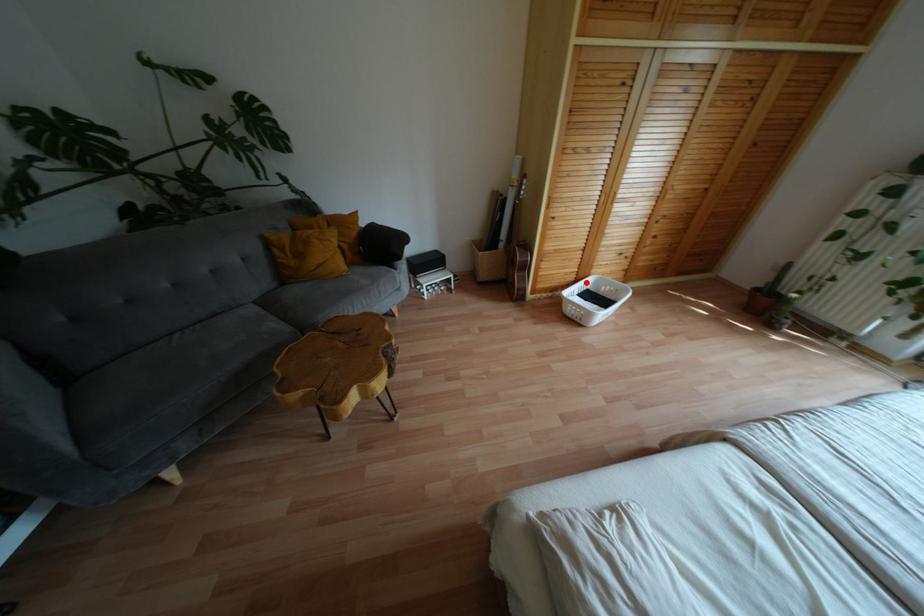
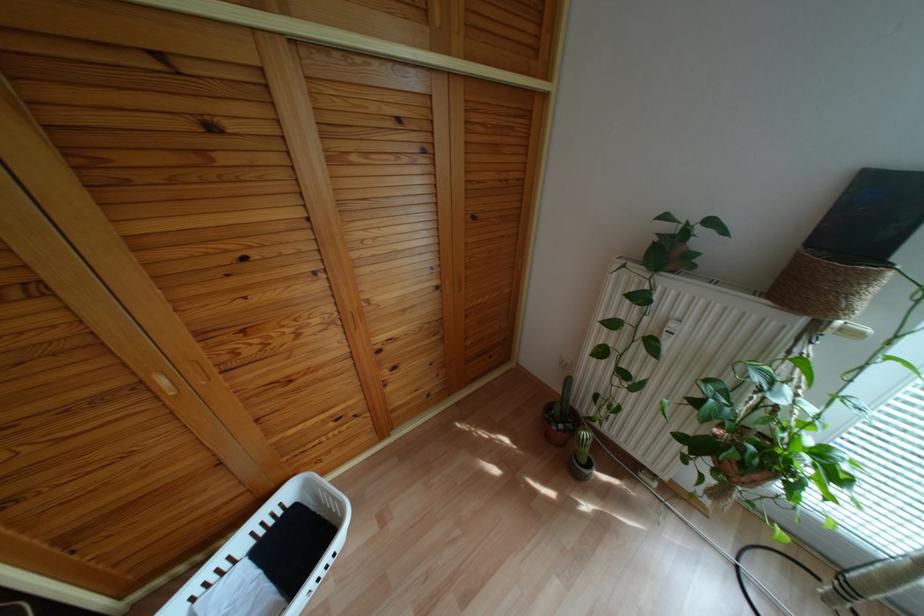
Question: I am providing you with two images of the same scene from different viewpoints. Image1 has a red point marked. In image2, the corresponding 3D location appears at what relative position? Reply with the corresponding letter.

Choices:
 (A) Closer
 (B) Farther

Answer: (B)